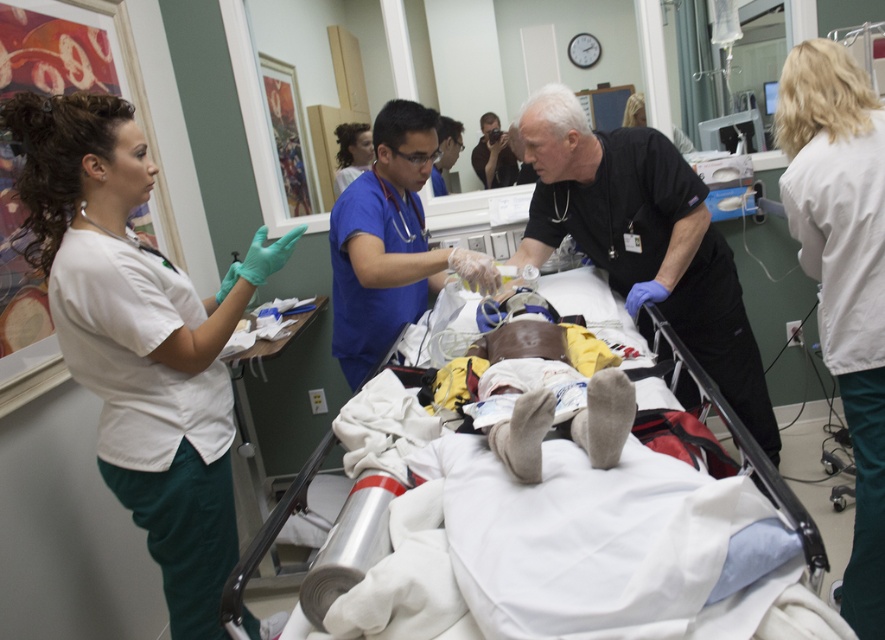
Does white smooth scrubs at left have a lesser width compared to black matte uniform at center?

Correct, white smooth scrubs at left's width is less than black matte uniform at center's.

Find the location of `white smooth scrubs at left`. white smooth scrubs at left is located at coordinates (139, 339).

Find the location of a particular element. This screenshot has width=885, height=640. white smooth scrubs at left is located at coordinates (139, 339).

Image resolution: width=885 pixels, height=640 pixels. What are the coordinates of `white smooth scrubs at left` in the screenshot? It's located at (139, 339).

Who is lower down, white smooth coat at upper right or blue scrubs at center?

white smooth coat at upper right

In the scene shown: How distant is white smooth coat at upper right from blue scrubs at center?

white smooth coat at upper right is 1.13 meters away from blue scrubs at center.

Describe the element at coordinates (843, 275) in the screenshot. I see `white smooth coat at upper right` at that location.

Where is `white smooth coat at upper right`? Image resolution: width=885 pixels, height=640 pixels. white smooth coat at upper right is located at coordinates (843, 275).

Is brown leather boots at center positioned at the back of white fabric hospital bed at center?

Yes, it is behind white fabric hospital bed at center.

At what (x,y) coordinates should I click in order to perform the action: click on brown leather boots at center. Please return your answer as a coordinate pair (x, y). The image size is (885, 640). Looking at the image, I should click on (522, 388).

Is point (524, 456) closer to camera compared to point (735, 436)?

Yes, point (524, 456) is closer to viewer.

You are a GUI agent. You are given a task and a screenshot of the screen. Output one action in this format:
    pyautogui.click(x=<x>, y=<y>)
    Task: Click on the brown leather boots at center
    The height and width of the screenshot is (640, 885).
    Given the screenshot: What is the action you would take?
    (x=522, y=388)